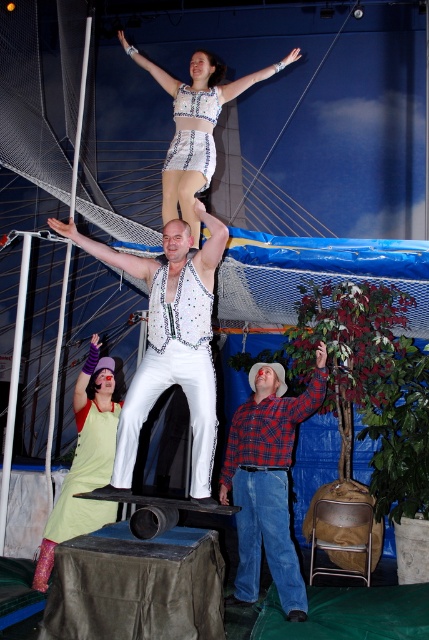
You are a photographer trying to capture the circus performer in the center. You notice the white sequined vest at center and the white fabric arm at upper center. Which object should you focus on first if you want to photograph the taller one?

The white sequined vest at center is taller than the white fabric arm at upper center, so you should focus on the white sequined vest at center first.

You are a photographer at the circus and need to capture both the light green fabric dress at center and the white sequined dress at upper center in a single shot. Which dress should you focus on first to ensure both are in frame?

The light green fabric dress at center is larger in size compared to the white sequined dress at upper center, so focusing on the light green fabric dress at center first will help ensure both are in frame.

You are a photographer capturing the circus performance. You notice the white sequined vest at center and the white fabric arm at upper center in your frame. Which object is positioned to the right of the other?

The white sequined vest at center is to the right of the white fabric arm at upper center.